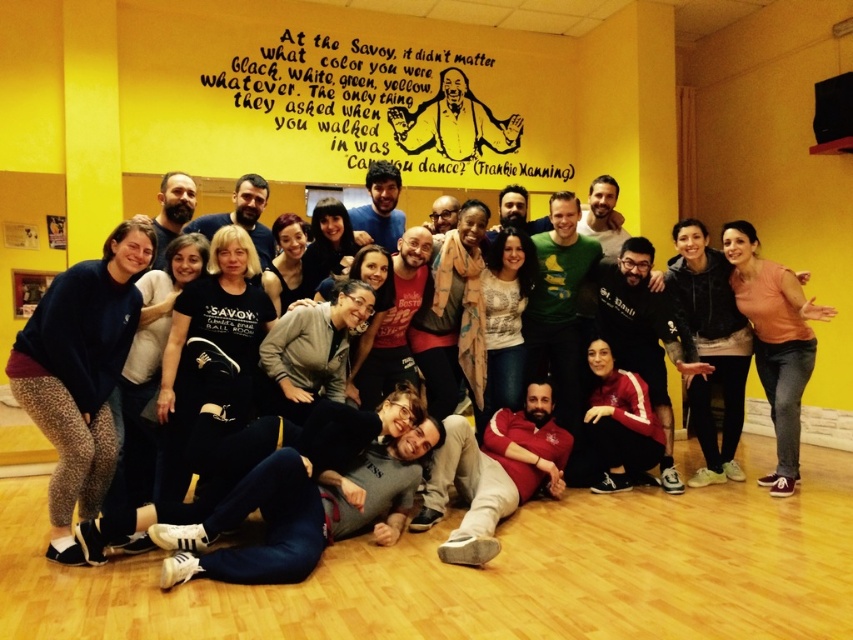
How distant is matte black t-shirt at center from matte black jacket at center?

matte black t-shirt at center is 1.32 meters from matte black jacket at center.

Is point (257, 236) less distant than point (15, 212)?

Yes, it is in front of point (15, 212).

What do you see at coordinates (242, 216) in the screenshot?
I see `matte black t-shirt at center` at bounding box center [242, 216].

Image resolution: width=853 pixels, height=640 pixels. Identify the location of matte black t-shirt at center. (242, 216).

Is dark blue fleece at lower left wider than matte black jacket at center?

Correct, the width of dark blue fleece at lower left exceeds that of matte black jacket at center.

Does dark blue fleece at lower left have a greater height compared to matte black jacket at center?

Yes.

Who is more distant from viewer, (68,513) or (24,205)?

Point (24,205)

This screenshot has width=853, height=640. Identify the location of dark blue fleece at lower left. (80, 372).

Does dark blue fleece at lower left have a smaller size compared to orange cotton shirt at right?

Yes.

Is point (39, 332) in front of point (743, 230)?

Yes, it is in front of point (743, 230).

Who is more forward, (102, 339) or (773, 396)?

Point (102, 339)

Where is `dark blue fleece at lower left`? dark blue fleece at lower left is located at coordinates (80, 372).